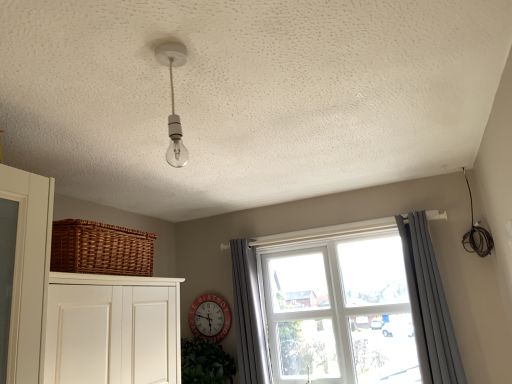
Question: From a real-world perspective, relative to gray fabric curtain at right, the 2th curtain positioned from the left, is gray fabric curtain at window, acting as the second curtain starting from the right, vertically above or below?

Choices:
 (A) below
 (B) above

Answer: (B)

Question: Does point (238, 269) appear closer or farther from the camera than point (421, 354)?

Choices:
 (A) farther
 (B) closer

Answer: (A)

Question: Considering the real-world distances, which object is farthest from the red metallic clock at center?

Choices:
 (A) clear glass bulb at center
 (B) gray fabric curtain at window, the first curtain from the left
 (C) woven brown basket at left
 (D) clear glass window at center
 (E) gray fabric curtain at right, the 2th curtain positioned from the left

Answer: (A)

Question: Which of these objects is positioned farthest from the gray fabric curtain at window, acting as the second curtain starting from the right?

Choices:
 (A) woven brown basket at left
 (B) red metallic clock at center
 (C) clear glass window at center
 (D) clear glass bulb at center
 (E) gray fabric curtain at right, the 2th curtain positioned from the left

Answer: (D)